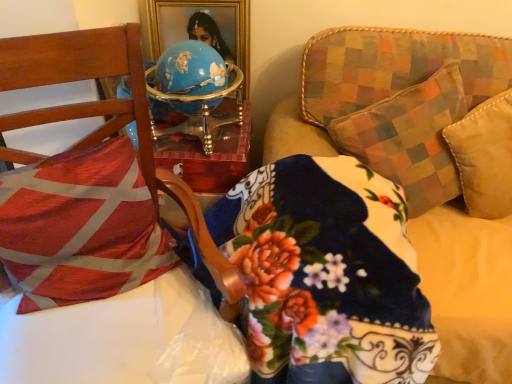
Question: Is red and white fabric pillow at left taller than wooden chair at left?

Choices:
 (A) no
 (B) yes

Answer: (A)

Question: From a real-world perspective, is red and white fabric pillow at left physically above wooden chair at left?

Choices:
 (A) yes
 (B) no

Answer: (A)

Question: Would you say red and white fabric pillow at left contains wooden chair at left?

Choices:
 (A) yes
 (B) no

Answer: (B)

Question: Is the surface of red and white fabric pillow at left in direct contact with wooden chair at left?

Choices:
 (A) yes
 (B) no

Answer: (A)

Question: Is red and white fabric pillow at left not inside wooden chair at left?

Choices:
 (A) yes
 (B) no

Answer: (B)

Question: From the image's perspective, does red and white fabric pillow at left appear lower than wooden chair at left?

Choices:
 (A) no
 (B) yes

Answer: (A)

Question: Is red and white fabric pillow at left positioned beyond the bounds of fluffy fabric couch at upper right?

Choices:
 (A) yes
 (B) no

Answer: (A)

Question: From the image's perspective, would you say red and white fabric pillow at left is positioned over fluffy fabric couch at upper right?

Choices:
 (A) no
 (B) yes

Answer: (B)

Question: Is red and white fabric pillow at left positioned in front of fluffy fabric couch at upper right?

Choices:
 (A) no
 (B) yes

Answer: (A)

Question: Is fluffy fabric couch at upper right surrounded by red and white fabric pillow at left?

Choices:
 (A) yes
 (B) no

Answer: (B)

Question: Considering the relative sizes of red and white fabric pillow at left and fluffy fabric couch at upper right in the image provided, is red and white fabric pillow at left shorter than fluffy fabric couch at upper right?

Choices:
 (A) yes
 (B) no

Answer: (A)

Question: Is red and white fabric pillow at left touching fluffy fabric couch at upper right?

Choices:
 (A) no
 (B) yes

Answer: (A)

Question: Would you say red and white fabric pillow at left is part of fluffy fabric couch at upper right's contents?

Choices:
 (A) no
 (B) yes

Answer: (A)